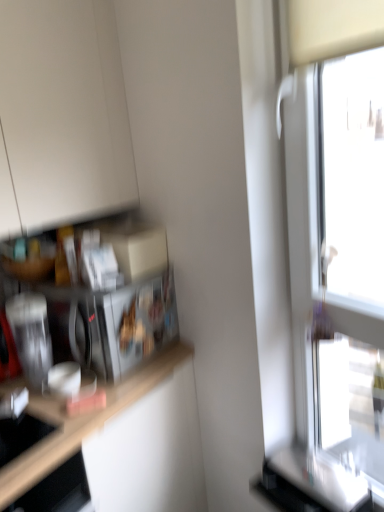
This screenshot has width=384, height=512. Describe the element at coordinates (91, 297) in the screenshot. I see `metallic silver microwave at left` at that location.

The image size is (384, 512). What are the coordinates of `brushed metal toaster at left` in the screenshot? It's located at (31, 335).

Consider the image. What's the angular difference between metallic silver microwave at left and transparent glass window at right's facing directions?

23 degrees.

Is metallic silver microwave at left aimed at transparent glass window at right?

No.

Considering the positions of objects metallic silver microwave at left and transparent glass window at right in the image provided, who is more to the right, metallic silver microwave at left or transparent glass window at right?

transparent glass window at right.

From the picture: Considering the positions of objects metallic silver microwave at left and transparent glass window at right in the image provided, who is behind, metallic silver microwave at left or transparent glass window at right?

metallic silver microwave at left is more distant.

From the image's perspective, who appears lower, metallic silver microwave at left or brushed metal toaster at left?

From the image's view, brushed metal toaster at left is below.

Considering the sizes of objects metallic silver microwave at left and brushed metal toaster at left in the image provided, who is taller, metallic silver microwave at left or brushed metal toaster at left?

metallic silver microwave at left.

Is metallic silver microwave at left next to brushed metal toaster at left and touching it?

No, metallic silver microwave at left is not making contact with brushed metal toaster at left.

Is point (16, 343) more distant than point (23, 331)?

That is True.

At what (x,y) coordinates should I click in order to perform the action: click on window located above the metallic silver microwave at left (from a real-world perspective). Please return your answer as a coordinate pair (x, y). Looking at the image, I should click on pos(337,254).

Consider the image. Who is shorter, transparent glass window at right or metallic silver microwave at left?

metallic silver microwave at left.

From a real-world perspective, is transparent glass window at right physically located above or below metallic silver microwave at left?

Clearly, from a real-world perspective, transparent glass window at right is above metallic silver microwave at left.

Between transparent glass window at right and metallic silver microwave at left, which one appears on the right side from the viewer's perspective?

Positioned to the right is transparent glass window at right.

How much distance is there between brushed metal toaster at left and metallic silver microwave at left?

brushed metal toaster at left and metallic silver microwave at left are 6.07 inches apart.

Between brushed metal toaster at left and metallic silver microwave at left, which one is positioned behind?

metallic silver microwave at left is further from the camera.

Is brushed metal toaster at left beside metallic silver microwave at left?

No, brushed metal toaster at left is not touching metallic silver microwave at left.

Considering the sizes of objects brushed metal toaster at left and metallic silver microwave at left in the image provided, who is shorter, brushed metal toaster at left or metallic silver microwave at left?

With less height is brushed metal toaster at left.

Who is smaller, brushed metal toaster at left or transparent glass window at right?

With smaller size is brushed metal toaster at left.

Is point (23, 313) less distant than point (353, 420)?

Yes, point (23, 313) is in front of point (353, 420).

Does brushed metal toaster at left touch transparent glass window at right?

brushed metal toaster at left and transparent glass window at right are clearly separated.

Is brushed metal toaster at left looking in the opposite direction of transparent glass window at right?

No, transparent glass window at right is not at the back of brushed metal toaster at left.

Is transparent glass window at right in contact with brushed metal toaster at left?

No, transparent glass window at right is not touching brushed metal toaster at left.

Which of these two, transparent glass window at right or brushed metal toaster at left, stands shorter?

brushed metal toaster at left is shorter.

Does transparent glass window at right lie in front of brushed metal toaster at left?

That is True.

Where is `window above the metallic silver microwave at left (from the image's perspective)`? Image resolution: width=384 pixels, height=512 pixels. window above the metallic silver microwave at left (from the image's perspective) is located at coordinates (337, 254).

Locate an element on the screen. The image size is (384, 512). appliance on the left of metallic silver microwave at left is located at coordinates (31, 335).

Which object lies further to the anchor point brushed metal toaster at left, transparent glass window at right or metallic silver microwave at left?

The object further to brushed metal toaster at left is transparent glass window at right.

Which object lies nearer to the anchor point brushed metal toaster at left, metallic silver microwave at left or transparent glass window at right?

Based on the image, metallic silver microwave at left appears to be nearer to brushed metal toaster at left.

From the image, which object appears to be nearer to transparent glass window at right, brushed metal toaster at left or metallic silver microwave at left?

metallic silver microwave at left is positioned closer to the anchor transparent glass window at right.

Estimate the real-world distances between objects in this image. Which object is closer to transparent glass window at right, metallic silver microwave at left or brushed metal toaster at left?

metallic silver microwave at left is closer to transparent glass window at right.

When comparing their distances from metallic silver microwave at left, does brushed metal toaster at left or transparent glass window at right seem closer?

brushed metal toaster at left is closer to metallic silver microwave at left.

Considering their positions, is transparent glass window at right positioned closer to metallic silver microwave at left than brushed metal toaster at left?

The object closer to metallic silver microwave at left is brushed metal toaster at left.

In order to click on shelf located between brushed metal toaster at left and transparent glass window at right in the left-right direction in this screenshot , I will do `click(91, 297)`.